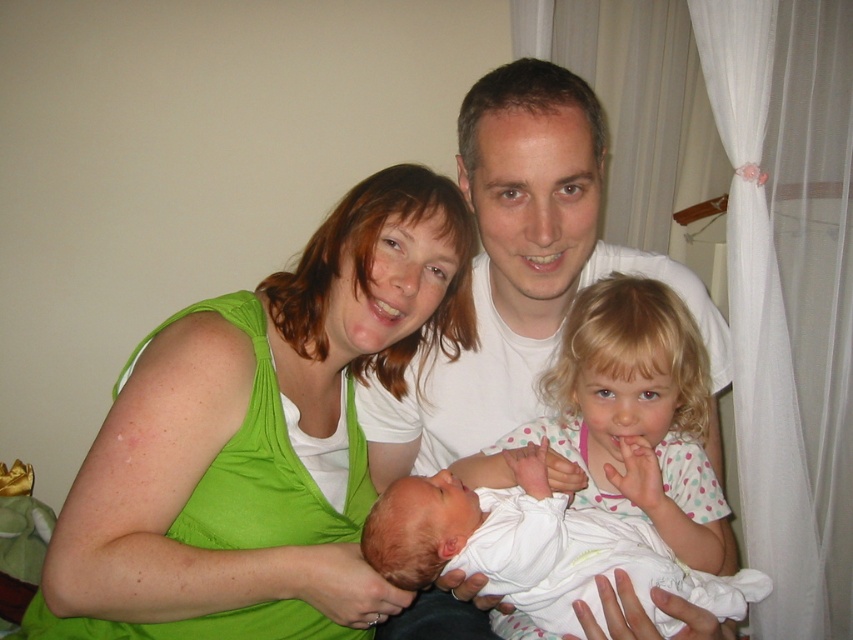
Question: Based on their relative distances, which object is nearer to the white smooth shirt at center?

Choices:
 (A) white soft fabric newborn at center
 (B) green fabric at center
 (C) white dotted shirt at center

Answer: (C)

Question: Which point is closer to the camera taking this photo?

Choices:
 (A) (706, 516)
 (B) (415, 321)
 (C) (558, 278)
 (D) (519, 580)

Answer: (D)

Question: Estimate the real-world distances between objects in this image. Which object is farther from the green fabric at center?

Choices:
 (A) white dotted shirt at center
 (B) white soft fabric newborn at center

Answer: (A)

Question: Does white smooth shirt at center have a greater width compared to white dotted shirt at center?

Choices:
 (A) no
 (B) yes

Answer: (B)

Question: Does white smooth shirt at center appear on the left side of white dotted shirt at center?

Choices:
 (A) yes
 (B) no

Answer: (A)

Question: Does white smooth shirt at center appear on the right side of white dotted shirt at center?

Choices:
 (A) yes
 (B) no

Answer: (B)